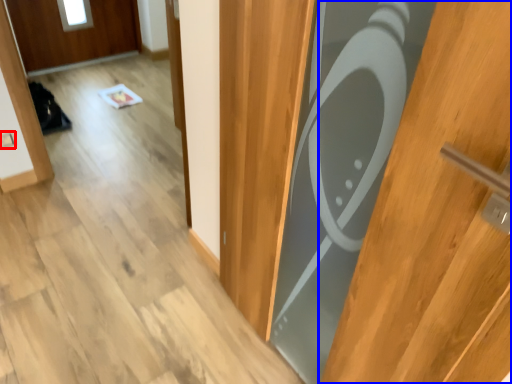
Question: Which point is further to the camera, electric outlet (highlighted by a red box) or door (highlighted by a blue box)?

Choices:
 (A) electric outlet
 (B) door

Answer: (A)